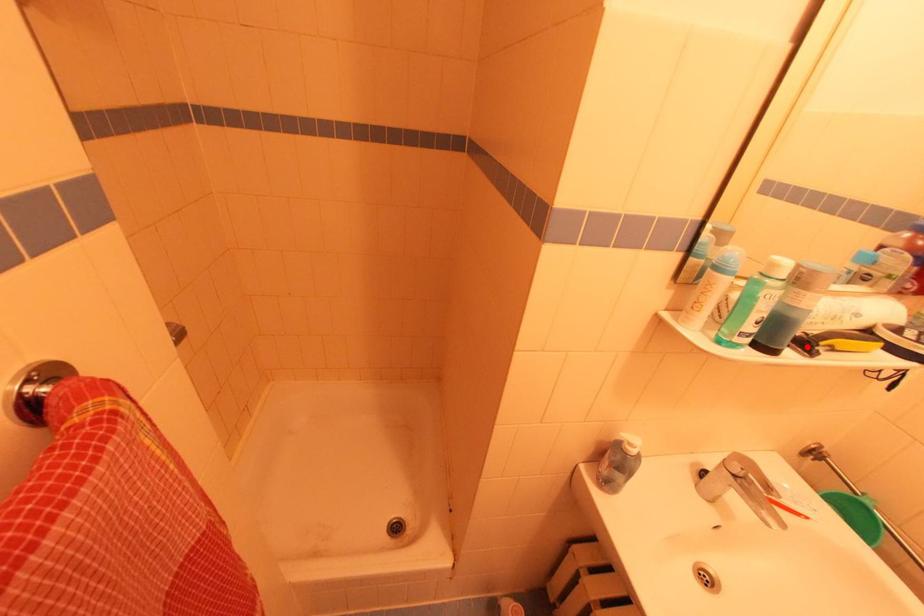
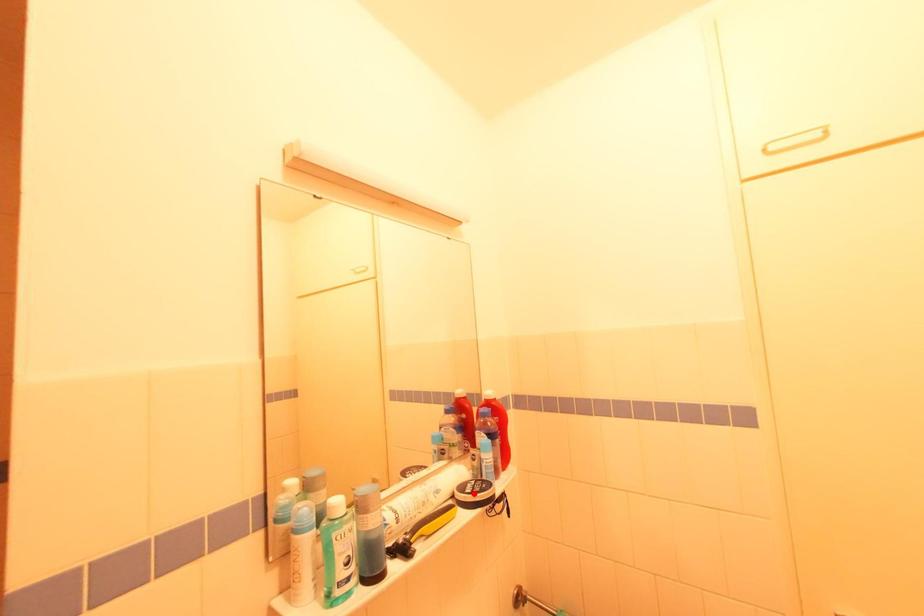
I am providing you with two images of the same scene from different viewpoints. A red point is marked on the first image and another point is marked on the second image. Are the points marked in image1 and image2 representing the same 3D position?

No